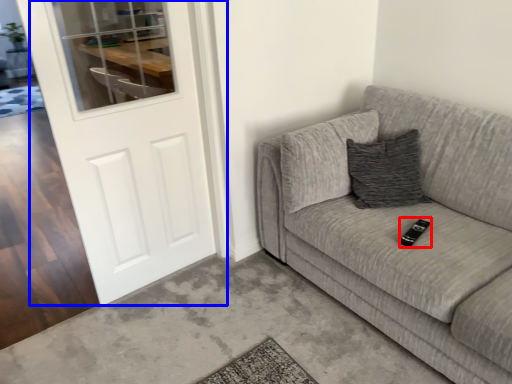
Question: Which of the following is the farthest to the observer, remote (highlighted by a red box) or door (highlighted by a blue box)?

Choices:
 (A) remote
 (B) door

Answer: (A)